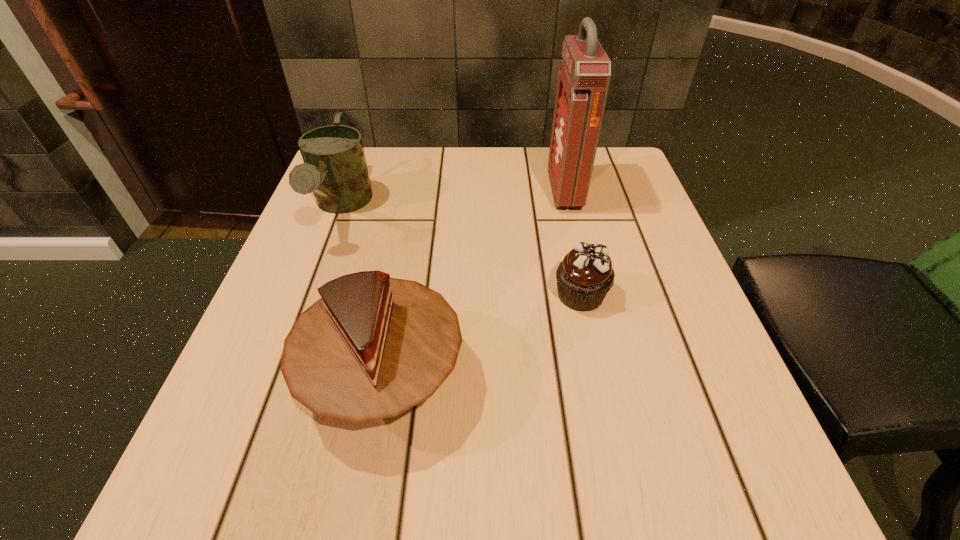
What are the coordinates of `the first-aid kit` in the screenshot? It's located at (584, 77).

The height and width of the screenshot is (540, 960). I want to click on watering can, so click(x=335, y=169).

I want to click on cake, so click(372, 347).

Image resolution: width=960 pixels, height=540 pixels. Find the location of `the shortest object`. the shortest object is located at coordinates (584, 277).

At what (x,y) coordinates should I click in order to perform the action: click on free space located on the front-facing side of the first-aid kit. Please return your answer as a coordinate pair (x, y). This screenshot has width=960, height=540. Looking at the image, I should click on (395, 191).

The image size is (960, 540). I want to click on vacant region located 0.150m on the front-facing side of the first-aid kit, so click(486, 191).

This screenshot has width=960, height=540. What are the coordinates of `vacant space located 0.260m on the front-facing side of the first-aid kit` in the screenshot? It's located at (438, 191).

Identify the location of vacant region located 0.130m with the spout on the watering can. (304, 303).

Locate an element on the screen. The width and height of the screenshot is (960, 540). vacant area located on the back of the cake is located at coordinates (403, 267).

Locate an element on the screen. The height and width of the screenshot is (540, 960). vacant space located on the back of the cupcake is located at coordinates (572, 257).